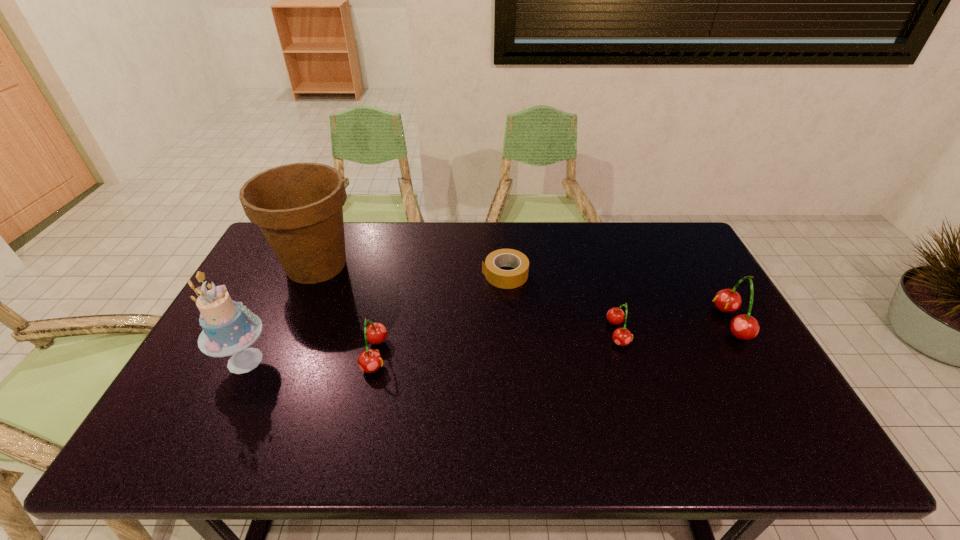
Image resolution: width=960 pixels, height=540 pixels. Find the location of `duct tape that is at the far edge`. duct tape that is at the far edge is located at coordinates (506, 279).

Where is `flowerpot at the left edge`? flowerpot at the left edge is located at coordinates (299, 207).

I want to click on cake that is at the left edge, so click(x=229, y=328).

In order to click on object situated at the right edge in this screenshot , I will do `click(745, 327)`.

I want to click on object that is at the far left corner, so click(x=299, y=207).

The height and width of the screenshot is (540, 960). What are the coordinates of `vacant region at the far edge of the desktop` in the screenshot? It's located at (375, 248).

The height and width of the screenshot is (540, 960). I want to click on blank area at the near edge, so click(x=324, y=403).

The width and height of the screenshot is (960, 540). In order to click on vacant space at the left edge of the desktop in this screenshot , I will do `click(228, 380)`.

At what (x,y) coordinates should I click in order to perform the action: click on vacant space at the right edge. Please return your answer as a coordinate pair (x, y). Image resolution: width=960 pixels, height=540 pixels. Looking at the image, I should click on (743, 343).

The width and height of the screenshot is (960, 540). In the image, there is a desktop. In order to click on free space at the far right corner in this screenshot , I will do `click(681, 246)`.